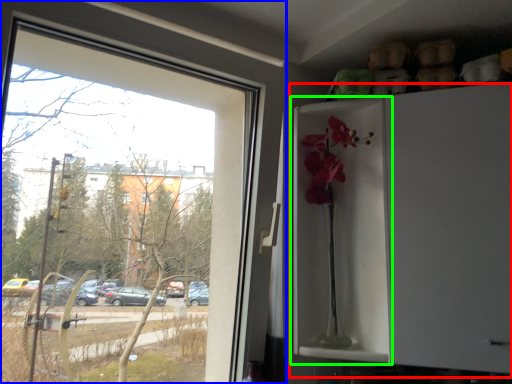
Question: Which is nearer to the fridge (highlighted by a red box)? window (highlighted by a blue box) or screen door (highlighted by a green box).

Choices:
 (A) window
 (B) screen door

Answer: (B)